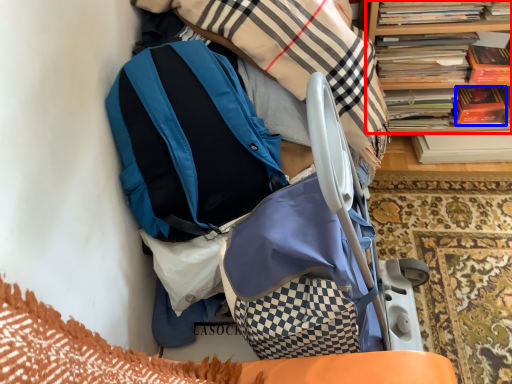
Question: Among these objects, which one is farthest to the camera, bookcase (highlighted by a red box) or paperback book (highlighted by a blue box)?

Choices:
 (A) bookcase
 (B) paperback book

Answer: (B)